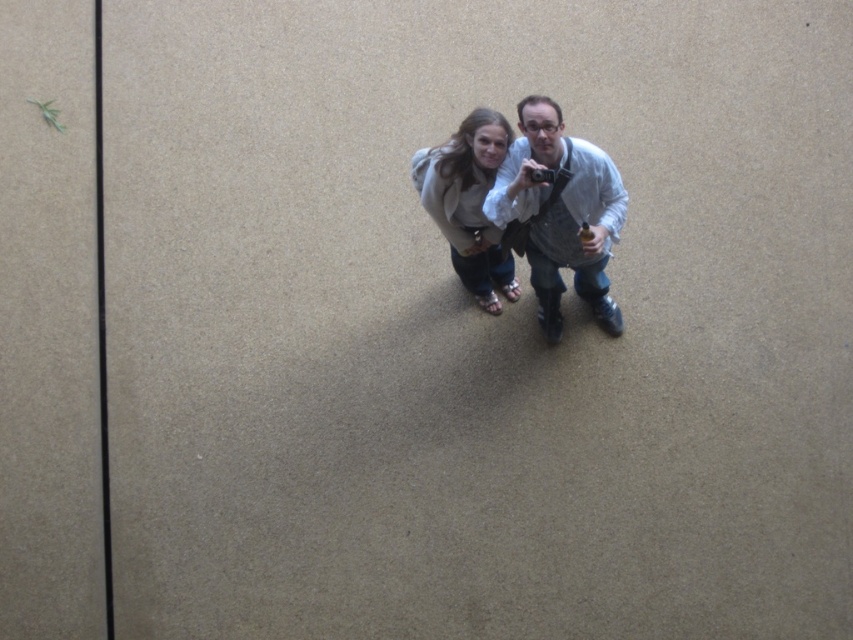
You are trying to determine which clothing item is wider between the white shirt at center and the light beige sweater at center. Based on the scene, which one is wider?

The white shirt at center is wider than the light beige sweater at center according to the description.

You are standing at the origin of a coordinate system in the image. You see a white shirt at center located at point (561, 212). If you move 0.1 units to the right along the x axis, will you be closer to the white shirt at center?

Moving 0.1 units to the right along the x axis from the origin would bring you to point 0.1, 0. The white shirt at center is located at point (561, 212). Since the x coordinate of the white shirt is 0.333, moving right to 0.1 would still be closer to the shirt than the origin, so yes, you would be closer.